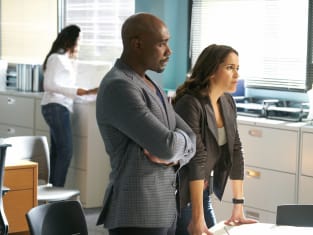
Image resolution: width=313 pixels, height=235 pixels. What are the coordinates of `windows` in the screenshot? It's located at (236, 30), (104, 31).